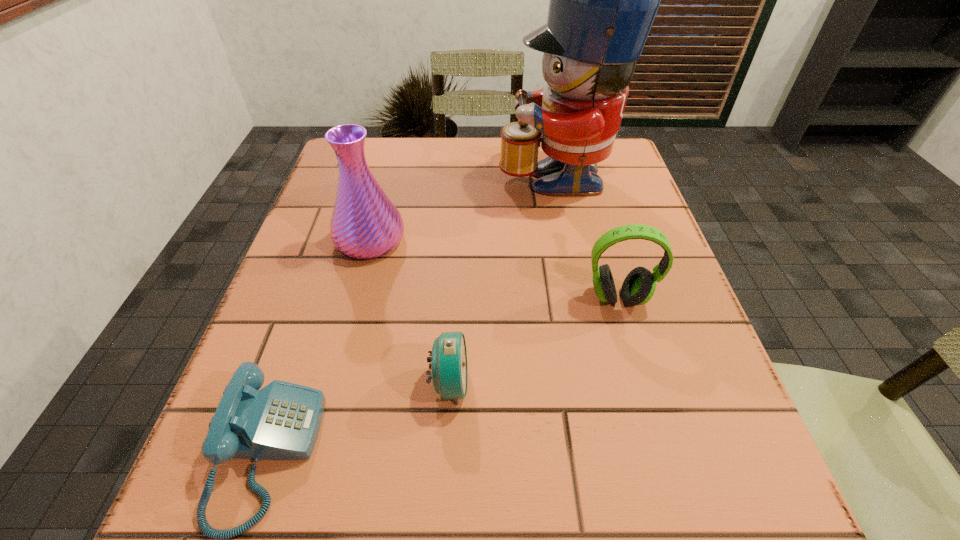
Where is `vacant space that's between the vase and the headset`? The height and width of the screenshot is (540, 960). vacant space that's between the vase and the headset is located at coordinates (494, 269).

Find the location of a particular element. vacant space in between the alarm clock and the farthest object is located at coordinates (502, 278).

This screenshot has height=540, width=960. Identify the location of empty location between the third nearest object and the fourth tallest object. (534, 341).

Image resolution: width=960 pixels, height=540 pixels. What are the coordinates of `the fourth closest object to the nutcracker` in the screenshot? It's located at pyautogui.click(x=281, y=421).

The width and height of the screenshot is (960, 540). What are the coordinates of `object that is the second closest to the third tallest object` in the screenshot? It's located at (449, 364).

The width and height of the screenshot is (960, 540). Identify the location of free location that satisfies the following two spatial constraints: 1. on the front-facing side of the headset; 2. on the left side of the farthest object. (581, 298).

This screenshot has width=960, height=540. I want to click on vacant area in the image that satisfies the following two spatial constraints: 1. on the front side of the second tallest object; 2. on the left side of the third farthest object, so click(x=355, y=298).